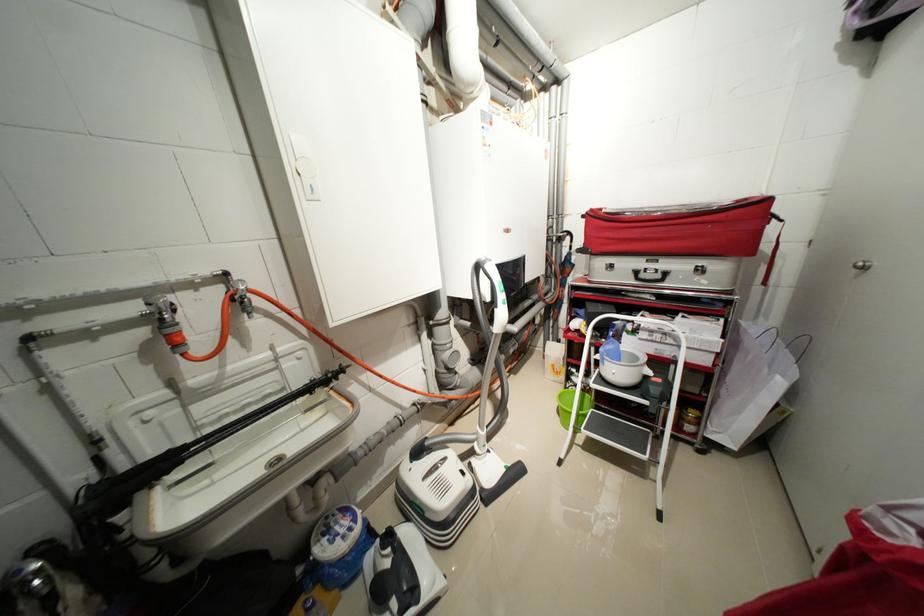
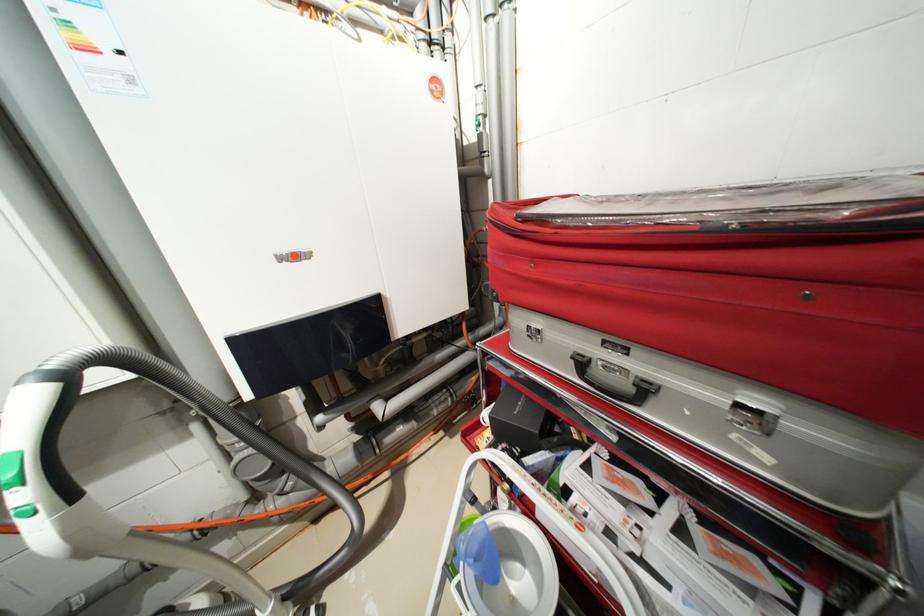
Which direction would the cameraman need to move to produce the second image?

The cameraman moved toward right, forward.